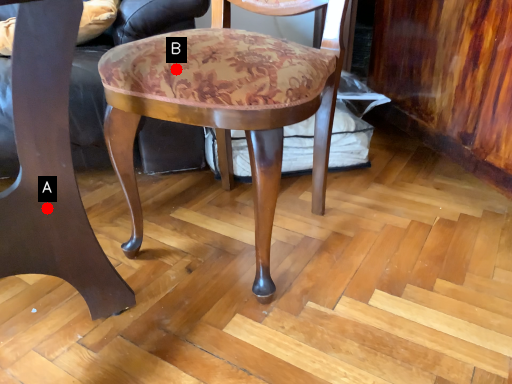
Question: Two points are circled on the image, labeled by A and B beside each circle. Which point appears closest to the camera in this image?

Choices:
 (A) A is closer
 (B) B is closer

Answer: (A)